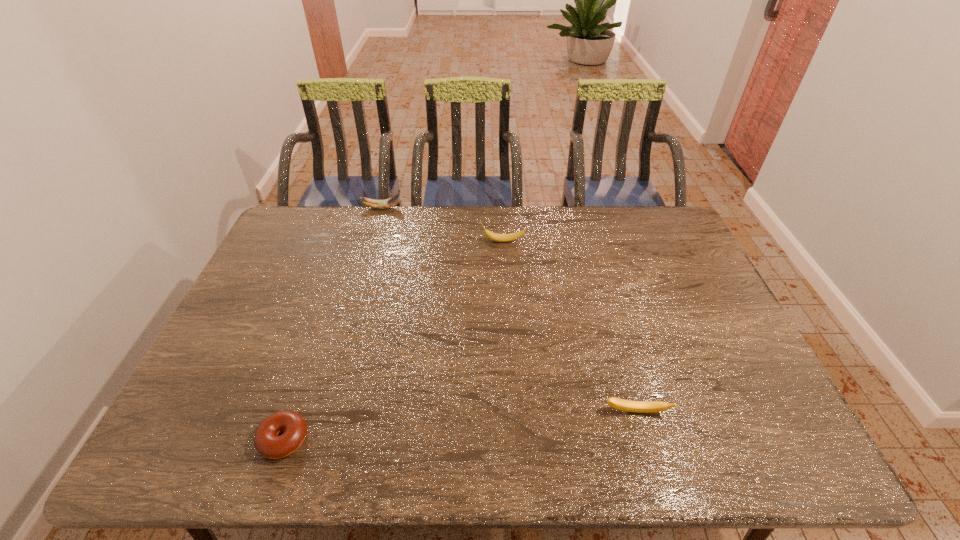
Identify which object is the second closest to the second tallest banana. Please provide its 2D coordinates. Your answer should be formatted as a tuple, i.e. [(x, y)], where the tuple contains the x and y coordinates of a point satisfying the conditions above.

[(625, 405)]

Point out which object is positioned as the nearest to the shortest object. Please provide its 2D coordinates. Your answer should be formatted as a tuple, i.e. [(x, y)], where the tuple contains the x and y coordinates of a point satisfying the conditions above.

[(625, 405)]

Locate which banana ranks in proximity to the farthest object. Please provide its 2D coordinates. Your answer should be formatted as a tuple, i.e. [(x, y)], where the tuple contains the x and y coordinates of a point satisfying the conditions above.

[(492, 236)]

Identify the location of banana that can be found as the closest to the farthest object. (492, 236).

Find the location of `free space in the image that satisfies the following two spatial constraints: 1. on the peel of the farthest banana; 2. on the front side of the doughnut`. free space in the image that satisfies the following two spatial constraints: 1. on the peel of the farthest banana; 2. on the front side of the doughnut is located at coordinates (316, 439).